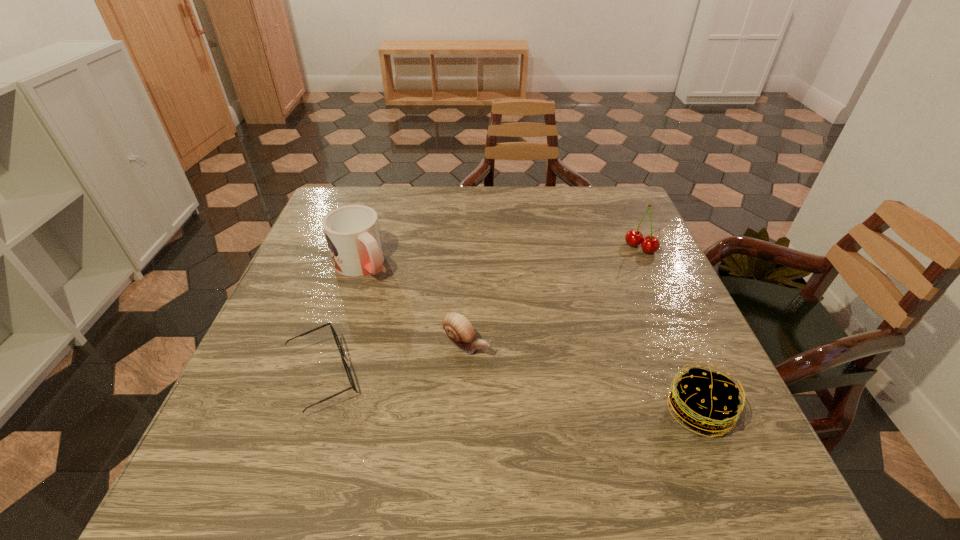
The image size is (960, 540). Identify the location of blank area located on the side of the mug with the handle. (403, 310).

Identify the location of vacant space situated with the stems of the cherry pointing upwards. The height and width of the screenshot is (540, 960). [x=588, y=303].

Where is `vacant space located with the stems of the cherry pointing upwards`? This screenshot has height=540, width=960. vacant space located with the stems of the cherry pointing upwards is located at coordinates tap(569, 322).

Image resolution: width=960 pixels, height=540 pixels. I want to click on free location located with the stems of the cherry pointing upwards, so click(x=583, y=308).

Where is `free space located on the front-facing side of the third object from left to right`? The image size is (960, 540). free space located on the front-facing side of the third object from left to right is located at coordinates (540, 388).

Where is `vacant space situated on the front-facing side of the third object from left to right`? vacant space situated on the front-facing side of the third object from left to right is located at coordinates (x=612, y=431).

This screenshot has width=960, height=540. What are the coordinates of `free location located on the front-facing side of the third object from left to right` in the screenshot? It's located at (608, 428).

Where is `spectacles present at the near edge`? The width and height of the screenshot is (960, 540). spectacles present at the near edge is located at coordinates (337, 341).

The width and height of the screenshot is (960, 540). I want to click on patty located in the near edge section of the desktop, so click(705, 400).

Where is `spectacles at the left edge`? This screenshot has height=540, width=960. spectacles at the left edge is located at coordinates (337, 341).